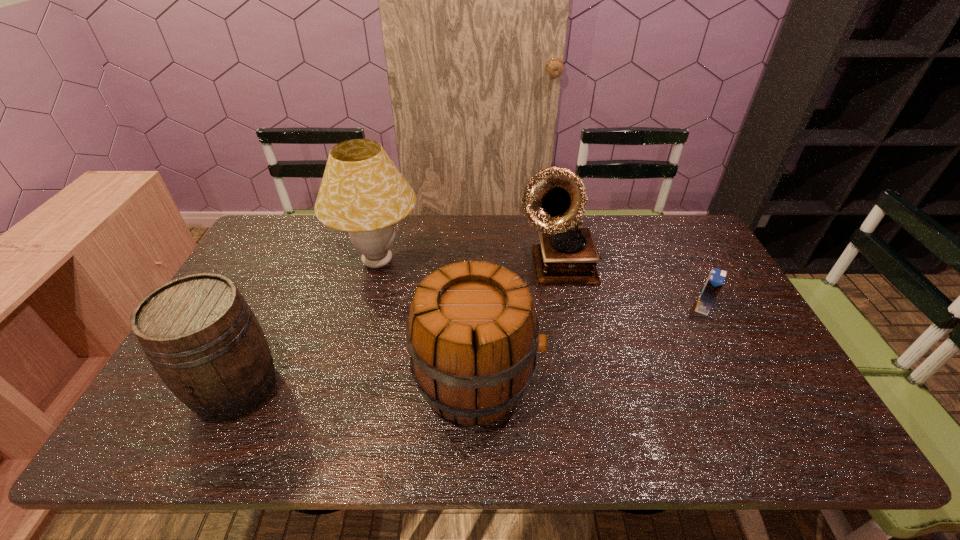
This screenshot has width=960, height=540. What are the coordinates of `the second object from left to right` in the screenshot? It's located at (362, 192).

The image size is (960, 540). Identify the location of record player. (554, 200).

Where is `the leftmost object`? The image size is (960, 540). the leftmost object is located at coordinates (200, 335).

Identify the location of the right cider. (472, 333).

At what (x,y) coordinates should I click in order to perform the action: click on the third farthest object. Please return your answer as a coordinate pair (x, y). Looking at the image, I should click on (715, 281).

What are the coordinates of `the rightmost object` in the screenshot? It's located at 715,281.

What are the coordinates of `vacant space located on the left of the lampshade` in the screenshot? It's located at (302, 262).

You are a GUI agent. You are given a task and a screenshot of the screen. Output one action in this format:
    pyautogui.click(x=<x>, y=<y>)
    Task: Click on the free location located on the horn of the record player
    Image resolution: width=960 pixels, height=540 pixels.
    Given the screenshot: What is the action you would take?
    pyautogui.click(x=570, y=329)

This screenshot has height=540, width=960. I want to click on vacant space located 0.200m on the side of the right cider where the spigot is located, so click(621, 381).

Locate an element on the screen. free space located 0.160m on the front of the rightmost object is located at coordinates (732, 361).